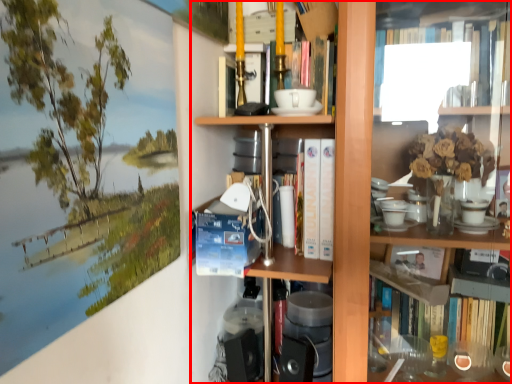
Question: Where is bookcase (annotated by the red box) located in relation to book in the image?

Choices:
 (A) right
 (B) left

Answer: (A)